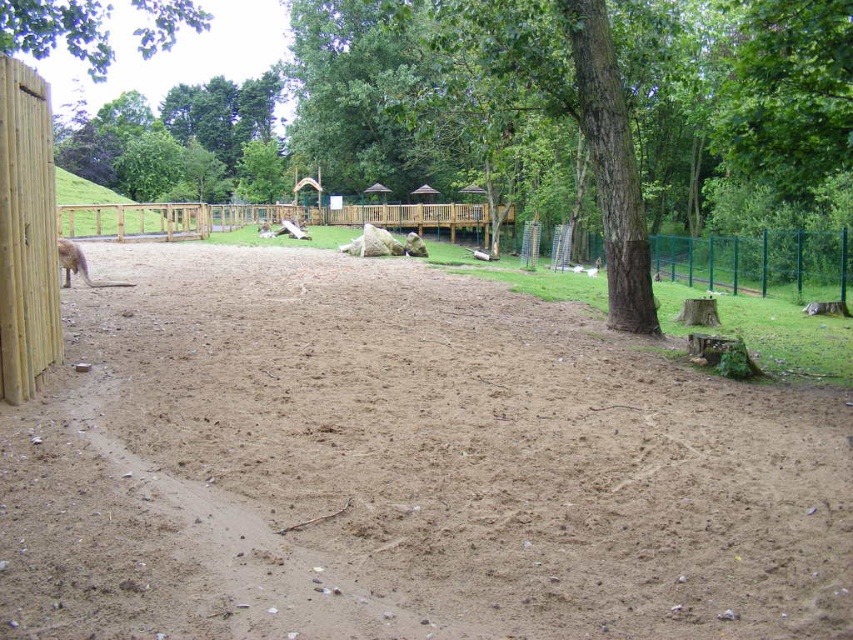
You are a zookeeper observing the brown sandy dirt field at center and the brown furry kangaroo at left in the enclosure. Which object is located to the left of the other?

The brown furry kangaroo at left is positioned to the left of the brown sandy dirt field at center.

You are standing at the entrance of the enclosure and want to reach the brown sandy dirt field at center. According to the coordinates provided, in which direction should you move from your current position?

The brown sandy dirt field at center is located at coordinates point (403, 468). Since you are at the entrance, you should move towards the center of the enclosure to reach it.